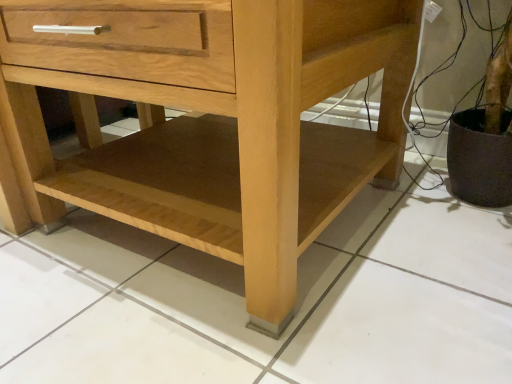
What do you see at coordinates (211, 121) in the screenshot? The image size is (512, 384). I see `natural wood chest of drawers at center` at bounding box center [211, 121].

You are a GUI agent. You are given a task and a screenshot of the screen. Output one action in this format:
    pyautogui.click(x=<x>, y=<y>)
    Task: Click on the natural wood chest of drawers at center
    
    Given the screenshot: What is the action you would take?
    pyautogui.click(x=211, y=121)

Identify the location of natural wood chest of drawers at center. (211, 121).